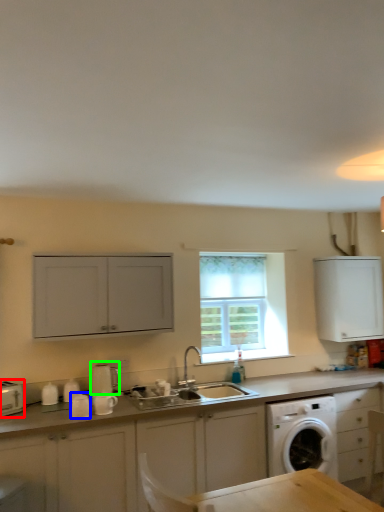
Question: Considering the real-world distances, which object is closest to appliance (highlighted by a red box)? appliance (highlighted by a blue box) or appliance (highlighted by a green box).

Choices:
 (A) appliance
 (B) appliance

Answer: (A)